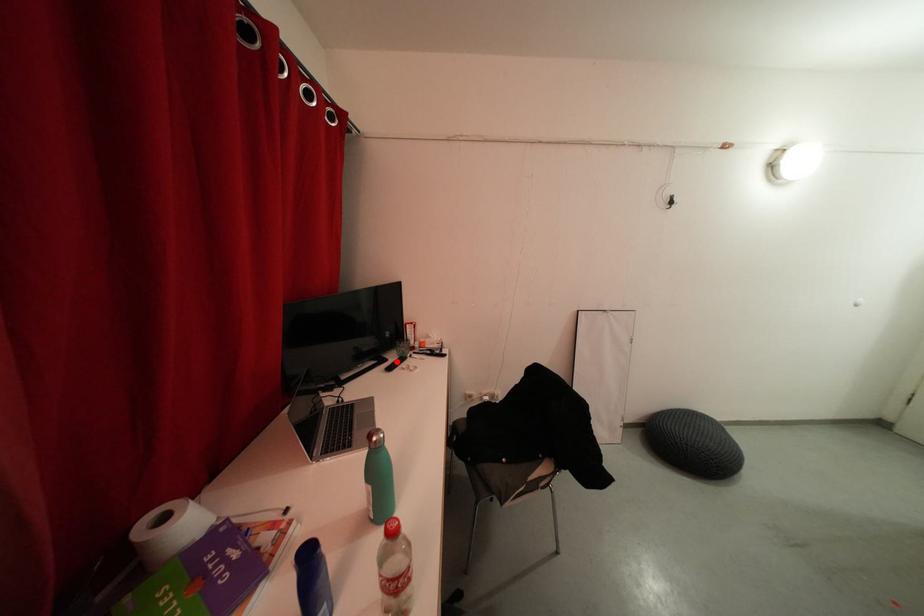
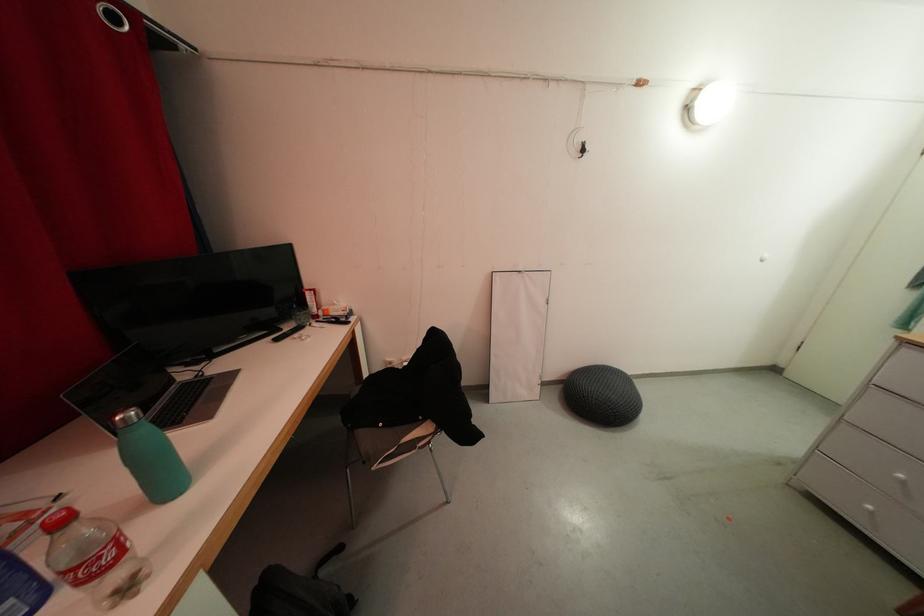
Locate, in the second image, the point that corresponds to the highlighted location in the first image.

(293, 331)